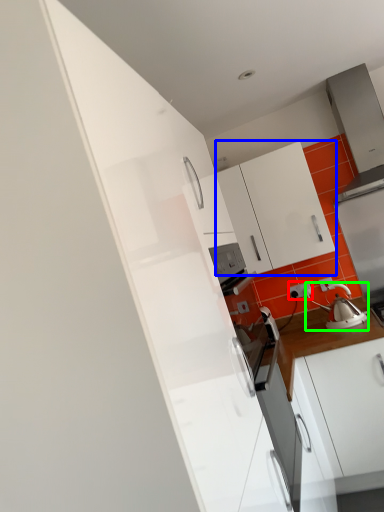
Question: Which is farther away from electric outlet (highlighted by a red box)? cabinetry (highlighted by a blue box) or tea pot (highlighted by a green box)?

Choices:
 (A) cabinetry
 (B) tea pot

Answer: (A)